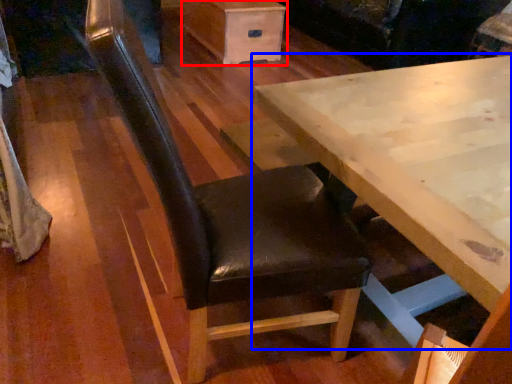
Question: Which object is closer to the camera taking this photo, drawer (highlighted by a red box) or table (highlighted by a blue box)?

Choices:
 (A) drawer
 (B) table

Answer: (B)